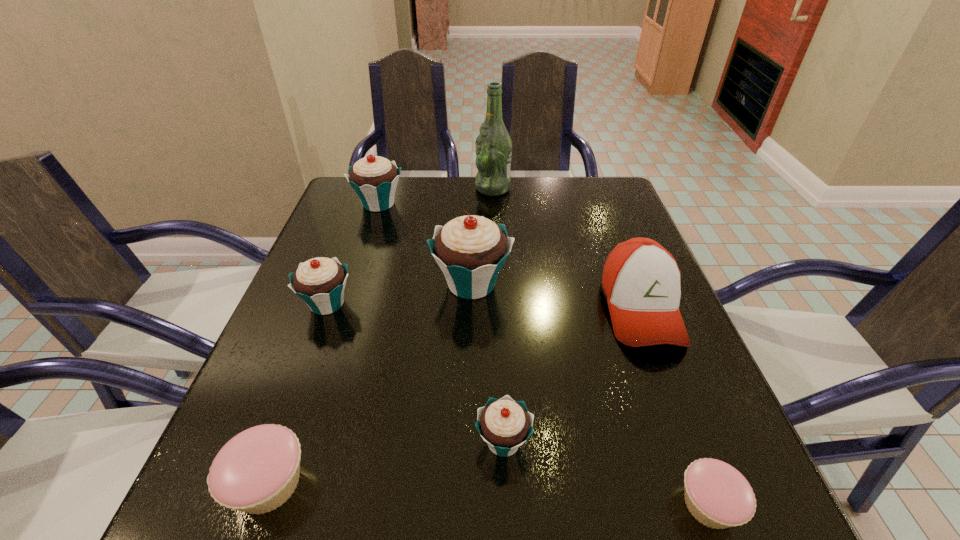
Find the location of a particular element. The image size is (960, 540). the tallest object is located at coordinates (493, 145).

Find the location of a particular element. Image resolution: width=960 pixels, height=540 pixels. beer bottle is located at coordinates (493, 145).

You are a GUI agent. You are given a task and a screenshot of the screen. Output one action in this format:
    pyautogui.click(x=<x>, y=<y>)
    Task: Click on the second tallest object
    The width and height of the screenshot is (960, 540).
    Given the screenshot: What is the action you would take?
    pyautogui.click(x=470, y=250)

Identify the location of the biggest teal cupcake. The image size is (960, 540). (470, 250).

Find the location of a particular element. The image size is (960, 540). the farthest teal cupcake is located at coordinates (374, 178).

At what (x,y) coordinates should I click in order to perform the action: click on the farthest cupcake. Please return your answer as a coordinate pair (x, y). Looking at the image, I should click on (374, 178).

Where is `baseball cap`? baseball cap is located at coordinates (641, 280).

At what (x,y) coordinates should I click in order to perform the action: click on the fourth shortest cupcake. Please return your answer as a coordinate pair (x, y). Image resolution: width=960 pixels, height=540 pixels. Looking at the image, I should click on (320, 282).

Find the location of a particular element. Image resolution: width=960 pixels, height=540 pixels. the nearest teal cupcake is located at coordinates (504, 424).

This screenshot has height=540, width=960. What are the coordinates of `the fourth tallest cupcake` in the screenshot? It's located at pos(504,424).